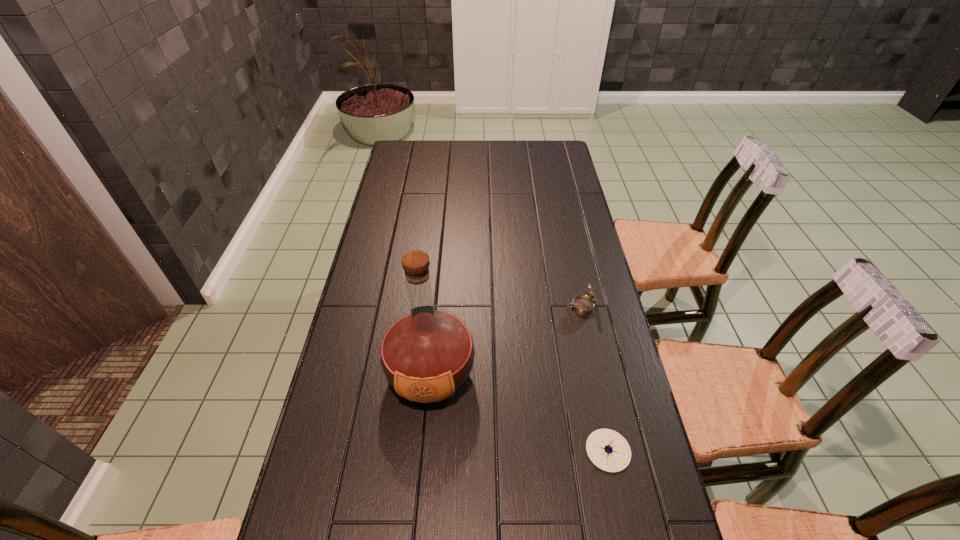
Identify the location of free space located on the left of the shorter compass. [x=471, y=450].

Where is `object that is positioned at the left edge`? This screenshot has width=960, height=540. object that is positioned at the left edge is located at coordinates (427, 354).

The height and width of the screenshot is (540, 960). Find the location of `free space at the far edge of the desktop`. free space at the far edge of the desktop is located at coordinates (500, 167).

At what (x,y) coordinates should I click in order to perform the action: click on free space at the left edge. Please return your answer as a coordinate pair (x, y). This screenshot has width=960, height=540. Looking at the image, I should click on (381, 226).

I want to click on free region at the right edge of the desktop, so click(574, 188).

This screenshot has width=960, height=540. In order to click on vacant region at the far left corner of the desktop in this screenshot , I will do `click(415, 141)`.

Identify the location of free area in between the farthest object and the shorter compass. (595, 379).

Identify the location of vacant area between the taller compass and the nearer compass. (595, 379).

You are a GUI agent. You are given a task and a screenshot of the screen. Output one action in this format:
    pyautogui.click(x=<x>, y=<y>)
    Task: Click on the unoccupied area between the farthest object and the nearer compass
    This screenshot has width=960, height=540.
    Given the screenshot: What is the action you would take?
    [595, 379]

This screenshot has width=960, height=540. Find the location of `vacant point located between the shorter compass and the second shortest object`. vacant point located between the shorter compass and the second shortest object is located at coordinates (595, 379).